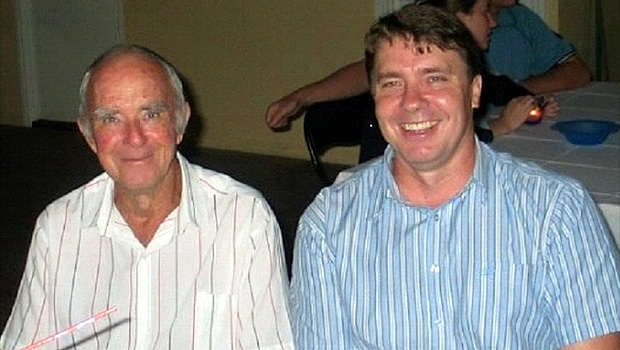
I want to click on wall, so click(x=263, y=62).